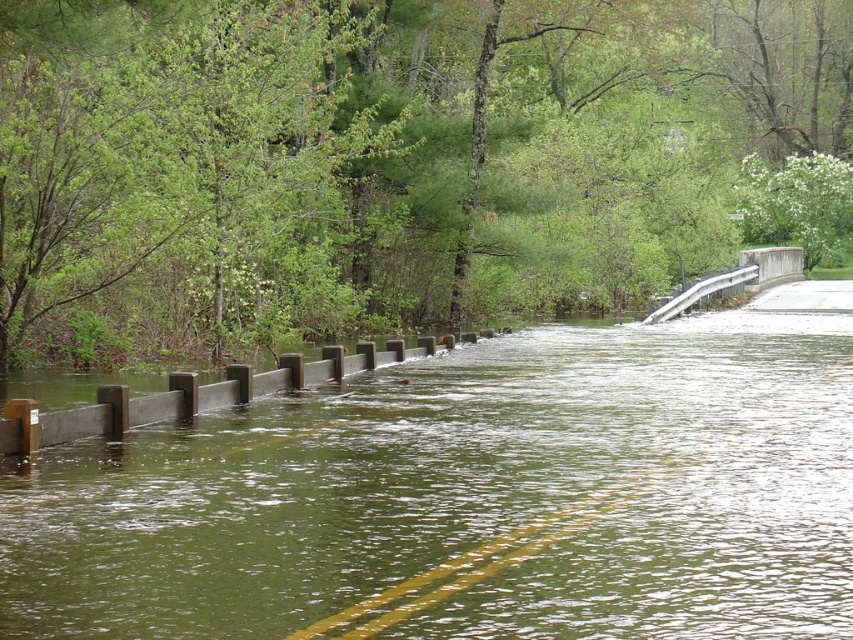
Based on the photo, you are a pedestrian standing on the flooded road and want to reach the point at coordinates (758, 264). You have to walk from the point at (654, 138). Since both points are on the flooded road, which direction should you walk to get closer to your destination?

You should walk away from the wooden barriers because point (654, 138) is closer to you than point (758, 264), so moving away from the barriers would take you towards the destination.